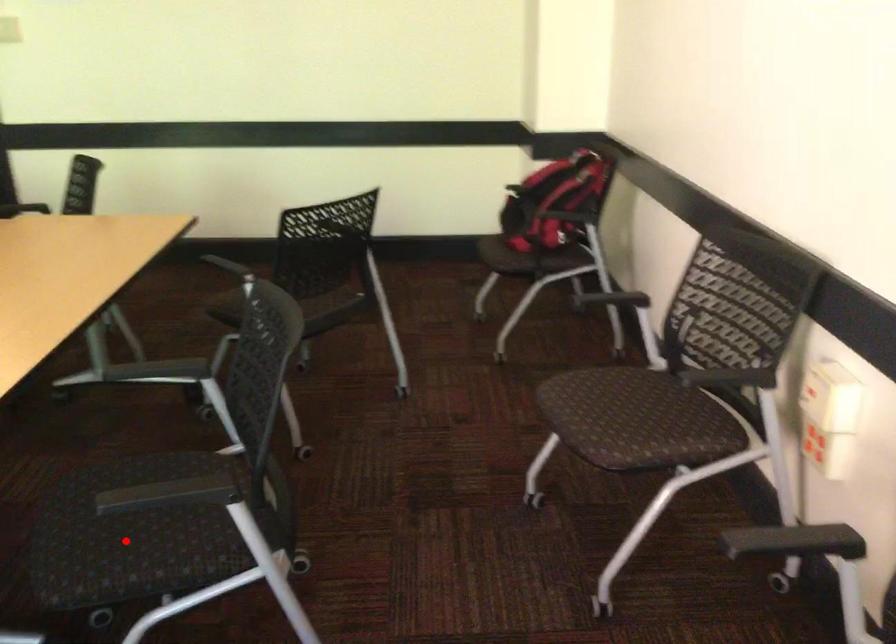
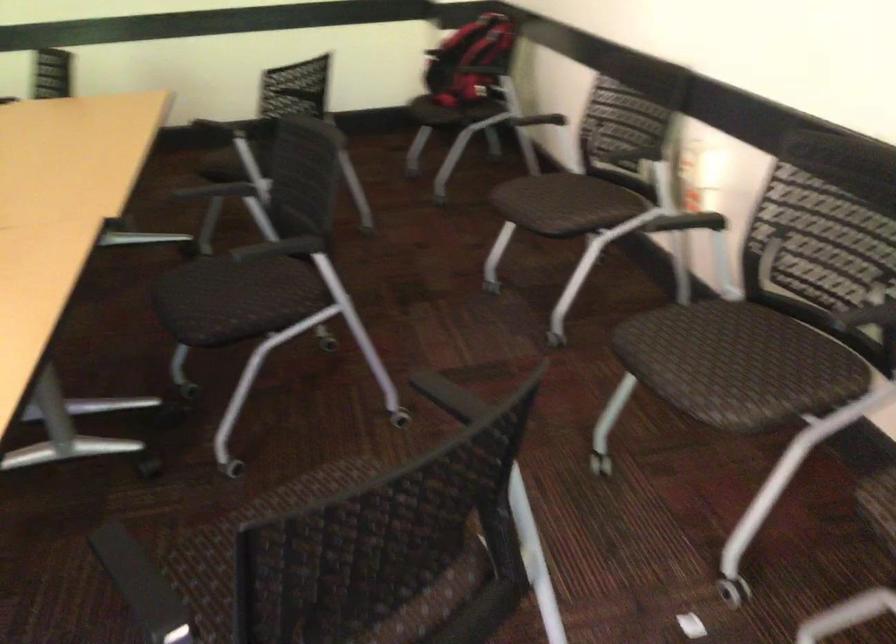
The point at the highlighted location is marked in the first image. Where is the corresponding point in the second image?

(222, 301)